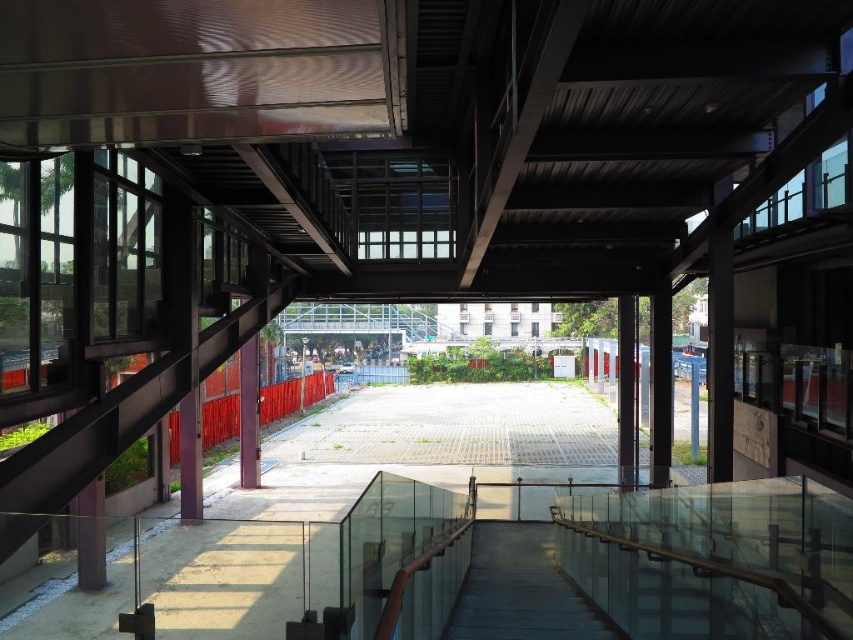
You are a maintenance worker needing to reach the transparent glass walkway at center and the smooth concrete stairs at center for inspection. Which one requires you to climb higher to reach?

The transparent glass walkway at center is taller than the smooth concrete stairs at center, so you need to climb higher to reach the transparent glass walkway at center.